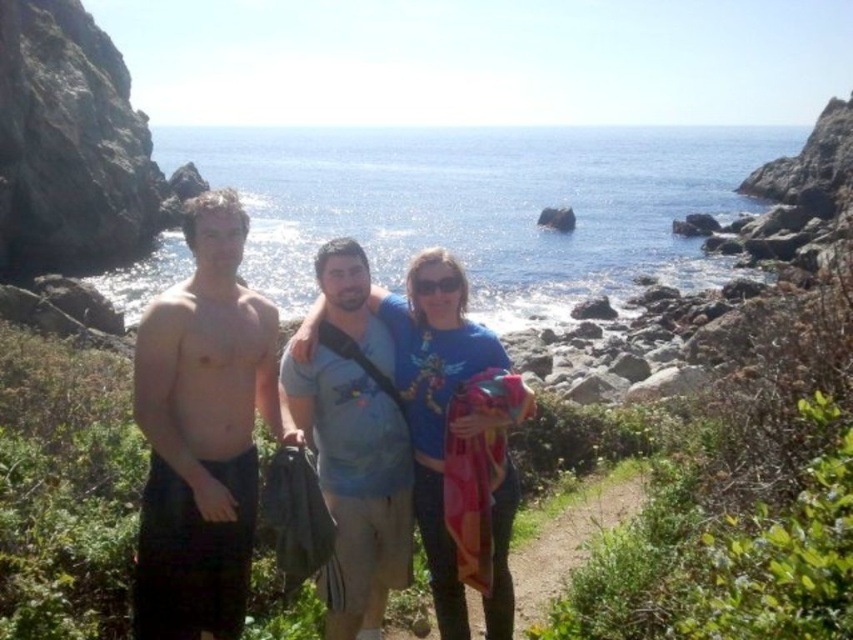
You are a photographer trying to capture the dark brown shorts at left in your shot. Based on their position, where should you aim your camera?

The dark brown shorts at left are located at the 2D coordinates of point 0.675 on the x axis and 0.239 on the y axis, so you should aim your camera at those coordinates to capture them.